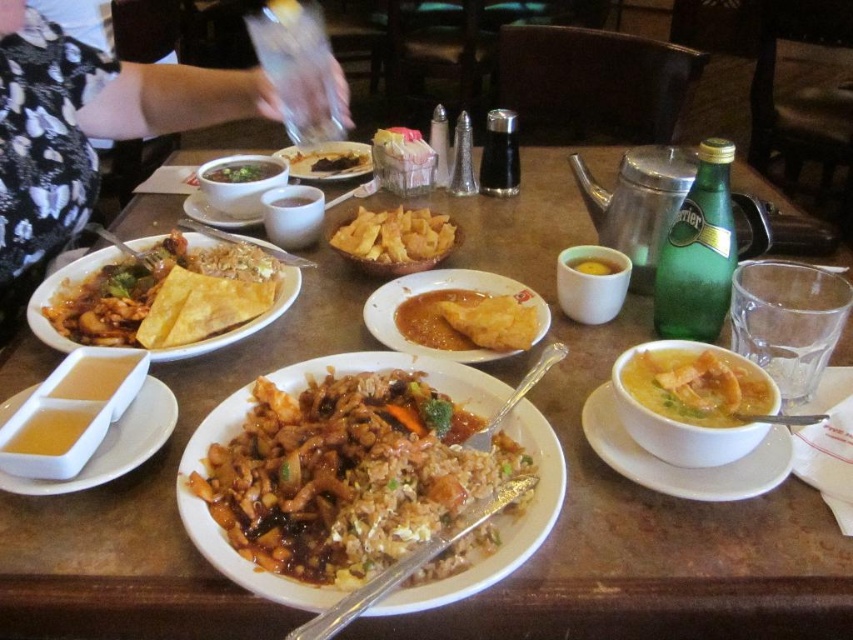
You are sitting at the dining table and want to reach for both items located at point (366, 403) and point (99, 316). Which item will your hand reach first?

The item at point (366, 403) will be reached first because it is closer to the viewer than the item at point (99, 316).

You are a server who needs to stack the matte white bowl at center right and the matte white plate at center on top of each other. Which one should you place at the bottom to ensure stability?

The matte white plate at center should be placed at the bottom since the matte white bowl at center right has a lesser height and would be more stable on top of it.